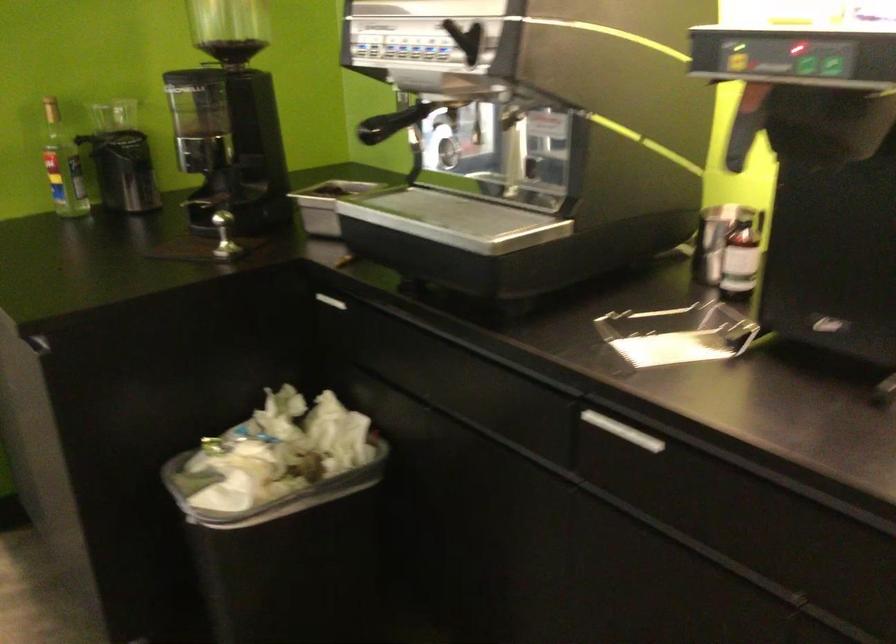
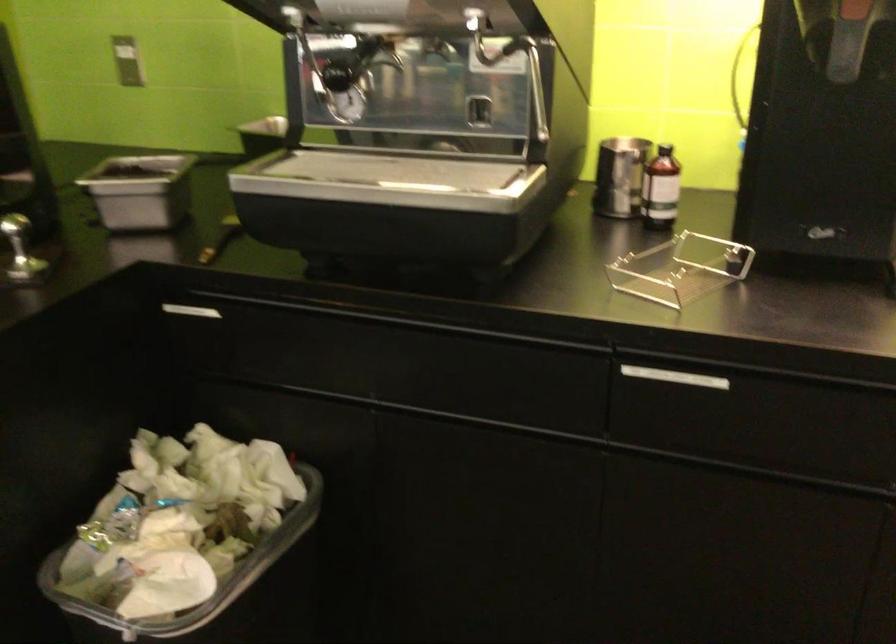
Find the pixel in the second image that matches (x=254, y=507) in the first image.

(218, 592)